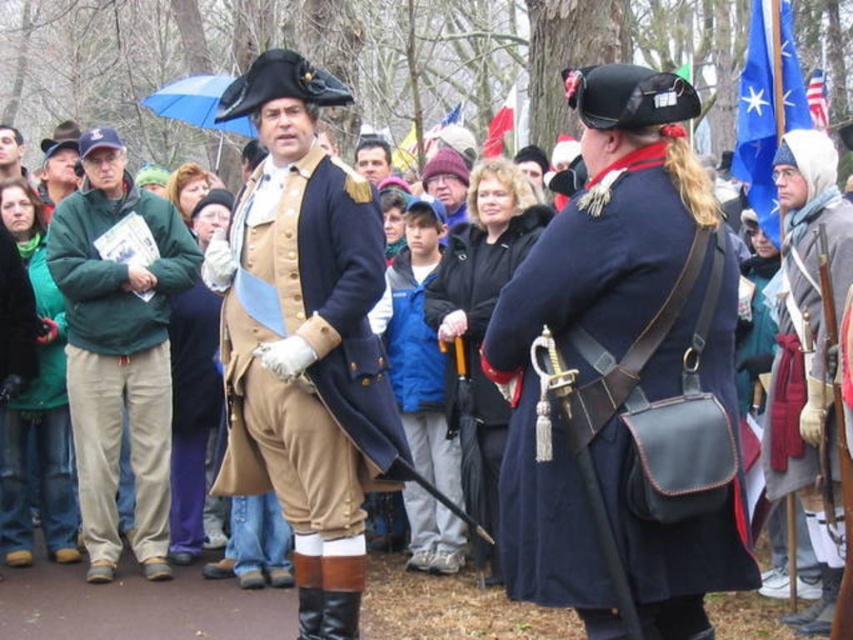
You are a costume designer preparing for a historical play. You have two jackets available for the main character. The navy blue leather coat at center and the blue fabric jacket at center. Based on the scene description, which jacket would be more appropriate for the main character to wear if they need a larger size?

The navy blue leather coat at center is bigger than the blue fabric jacket at center, so it would be more appropriate for the main character needing a larger size.

You are a historian analyzing this historical reenactment scene. You notice a point at coordinates (766, 106). Based on the scene description, what object is located at that point?

The point at coordinates (766, 106) corresponds to the blue fabric flag at upper right.

You are a photographer at the historical reenactment scene. You want to take a photo that includes both the blue fabric flag at upper right and the american flag at upper right. Which flag should you position closer to the camera to ensure both are visible in the frame?

To ensure both the blue fabric flag at upper right and the american flag at upper right are visible in the frame, you should position the blue fabric flag at upper right closer to the camera since it is already in front of the american flag at upper right.